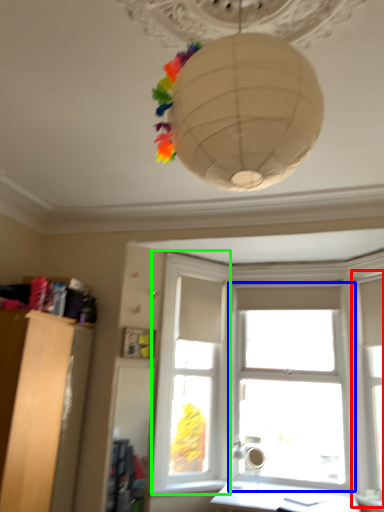
Question: Based on their relative distances, which object is farther from window frame (highlighted by a red box)? Choose from window (highlighted by a blue box) and window frame (highlighted by a green box).

Choices:
 (A) window
 (B) window frame

Answer: (B)